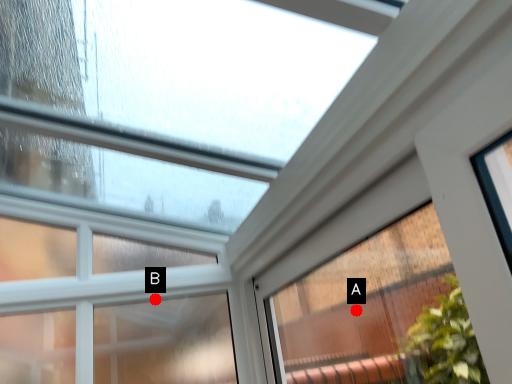
Question: Two points are circled on the image, labeled by A and B beside each circle. Which of the following is the closest to the observer?

Choices:
 (A) A is closer
 (B) B is closer

Answer: (B)